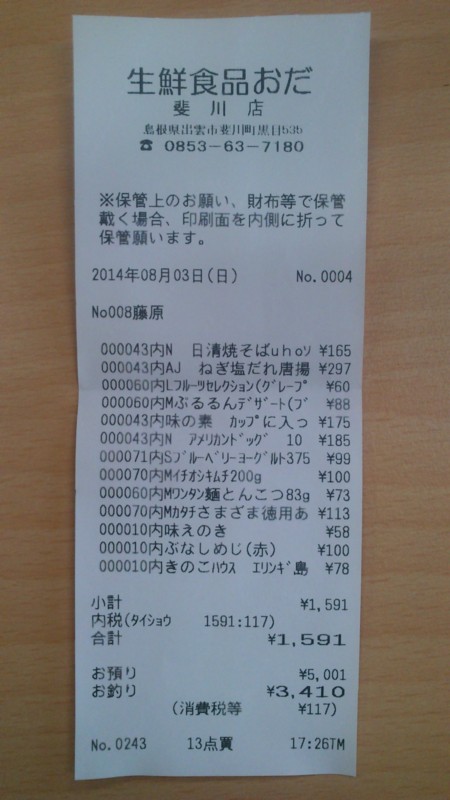
Image resolution: width=450 pixels, height=800 pixels. Find the location of `table`. table is located at coordinates point(42,518).